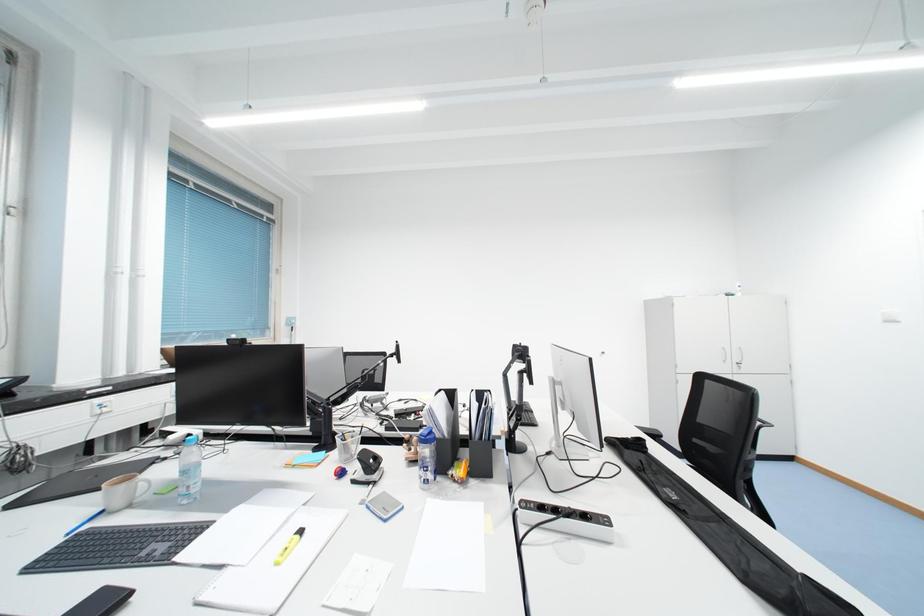
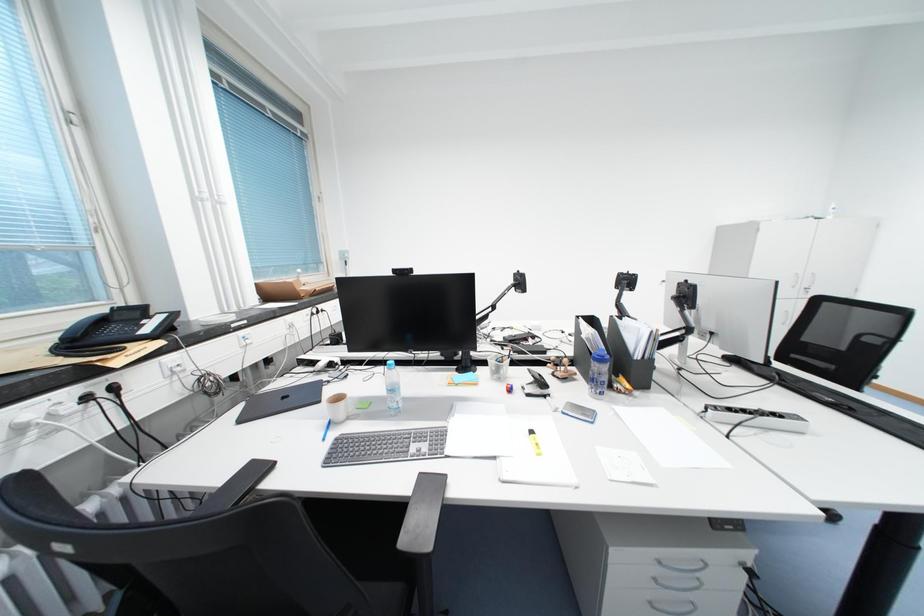
Question: The images are taken continuously from a first-person perspective. In which direction is your viewpoint rotating?

Choices:
 (A) Left
 (B) Right
 (C) Up
 (D) Down

Answer: (D)